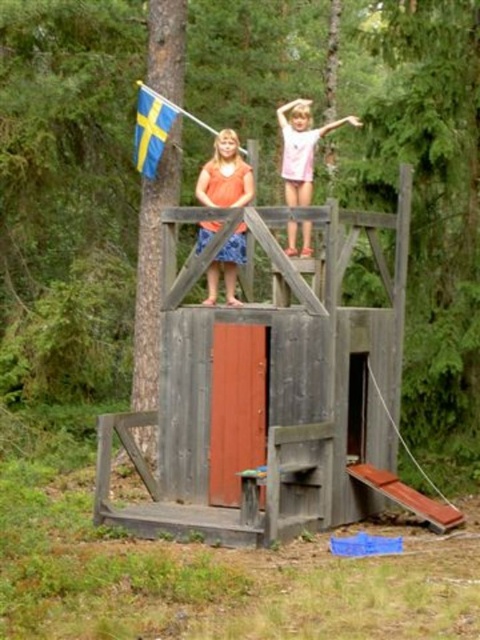
Is orange fabric dress at center thinner than blue fabric flag at upper left?

Indeed, orange fabric dress at center has a lesser width compared to blue fabric flag at upper left.

Who is more distant from viewer, (205, 305) or (163, 131)?

Positioned behind is point (163, 131).

Who is more distant from viewer, (224,260) or (139,104)?

The point (139,104) is more distant.

Image resolution: width=480 pixels, height=640 pixels. I want to click on orange fabric dress at center, so click(225, 173).

Who is lower down, wooden playhouse at center or pink cotton shirt at upper center?

wooden playhouse at center is lower down.

Find the location of a particular element. The image size is (480, 640). wooden playhouse at center is located at coordinates (272, 388).

Who is more forward, [309,468] or [311,168]?

Point [309,468]

Locate an element on the screen. The image size is (480, 640). wooden playhouse at center is located at coordinates (272, 388).

Does pink cotton shirt at upper center come behind blue fabric flag at upper left?

No.

Between point (304, 202) and point (163, 109), which one is positioned behind?

Point (163, 109)

This screenshot has width=480, height=640. I want to click on pink cotton shirt at upper center, so 301,147.